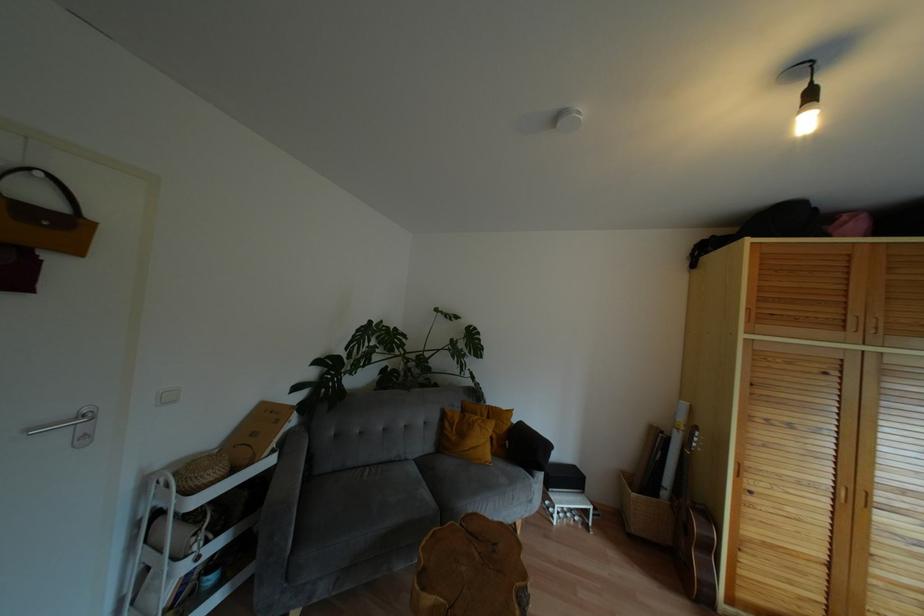
Where would you push the silver door handle? Please return your answer as a coordinate pair (x, y).

(73, 427)